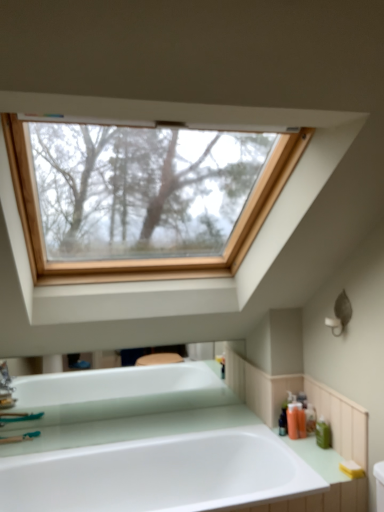
Identify the location of free point to the left of yellow sponge at lower right. (321, 473).